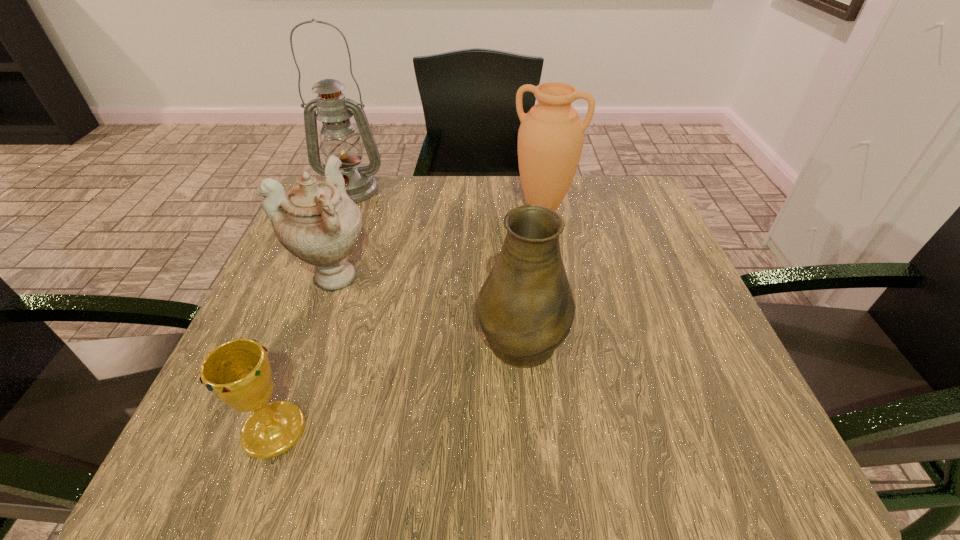
Locate an element on the screen. oil lamp is located at coordinates (339, 137).

Locate an element on the screen. The height and width of the screenshot is (540, 960). the farther urn is located at coordinates (550, 139).

The image size is (960, 540). What are the coordinates of `the taller urn` in the screenshot? It's located at (550, 139).

The width and height of the screenshot is (960, 540). Identify the location of pitcher. (526, 309).

Locate an element on the screen. This screenshot has height=540, width=960. the nearer urn is located at coordinates (316, 221).

Where is `the left urn`? the left urn is located at coordinates click(316, 221).

In order to click on the shortest object in this screenshot , I will do `click(238, 372)`.

Find the location of a particular element. Image resolution: width=960 pixels, height=540 pixels. the nearest object is located at coordinates (238, 372).

Find the location of a particular element. blank area located on the front of the tallest object is located at coordinates (318, 274).

This screenshot has width=960, height=540. I want to click on free space located 0.150m on the right of the right urn, so click(x=636, y=207).